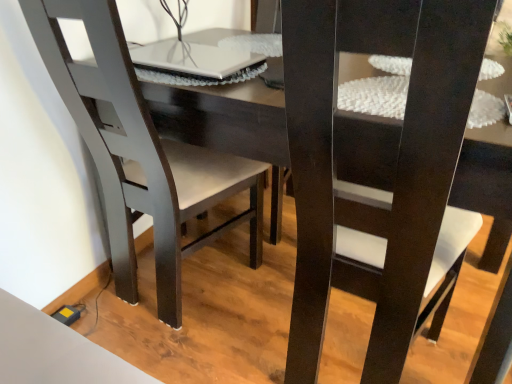
Question: Does white glossy laptop at upper center have a smaller size compared to matte black chair at left, the first chair when ordered from left to right?

Choices:
 (A) yes
 (B) no

Answer: (A)

Question: Does white glossy laptop at upper center have a larger size compared to matte black chair at left, the first chair when ordered from left to right?

Choices:
 (A) no
 (B) yes

Answer: (A)

Question: From the image's perspective, is white glossy laptop at upper center below matte black chair at left, which is the 2th chair from right to left?

Choices:
 (A) no
 (B) yes

Answer: (A)

Question: Is white glossy laptop at upper center oriented towards matte black chair at left, the first chair when ordered from left to right?

Choices:
 (A) yes
 (B) no

Answer: (A)

Question: Is matte black chair at left, which is the 2th chair from right to left, a part of white glossy laptop at upper center?

Choices:
 (A) no
 (B) yes

Answer: (A)

Question: Can you confirm if white glossy laptop at upper center is wider than matte black chair at left, which is the 2th chair from right to left?

Choices:
 (A) no
 (B) yes

Answer: (A)

Question: Considering the relative positions of matte black chair at center, the 2th chair positioned from the left, and white glossy laptop at upper center in the image provided, is matte black chair at center, the 2th chair positioned from the left, to the right of white glossy laptop at upper center from the viewer's perspective?

Choices:
 (A) no
 (B) yes

Answer: (B)

Question: Can you confirm if matte black chair at center, the 2th chair positioned from the left, is taller than white glossy laptop at upper center?

Choices:
 (A) yes
 (B) no

Answer: (A)

Question: Is matte black chair at center, the 2th chair positioned from the left, positioned behind white glossy laptop at upper center?

Choices:
 (A) yes
 (B) no

Answer: (B)

Question: Is matte black chair at center, which is counted as the 1th chair, starting from the right, wider than white glossy laptop at upper center?

Choices:
 (A) no
 (B) yes

Answer: (B)

Question: Is matte black chair at center, the 2th chair positioned from the left, next to white glossy laptop at upper center?

Choices:
 (A) no
 (B) yes

Answer: (A)

Question: Can you confirm if matte black chair at center, which is counted as the 1th chair, starting from the right, is shorter than white glossy laptop at upper center?

Choices:
 (A) no
 (B) yes

Answer: (A)

Question: Is matte black chair at center, the 2th chair positioned from the left, far from matte black chair at left, which is the 2th chair from right to left?

Choices:
 (A) yes
 (B) no

Answer: (B)